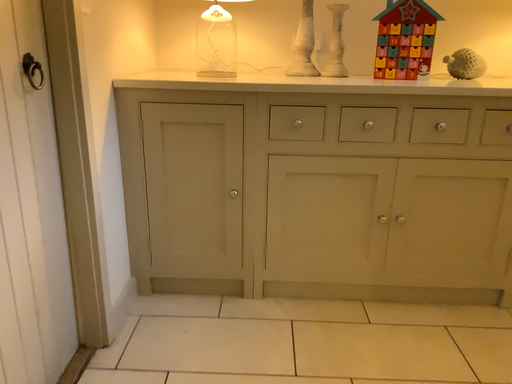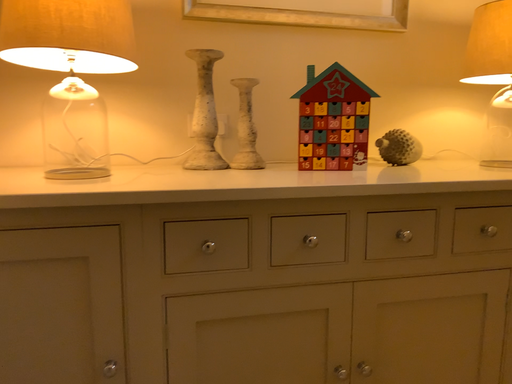
Question: How did the camera likely rotate when shooting the video?

Choices:
 (A) rotated upward
 (B) rotated downward

Answer: (A)